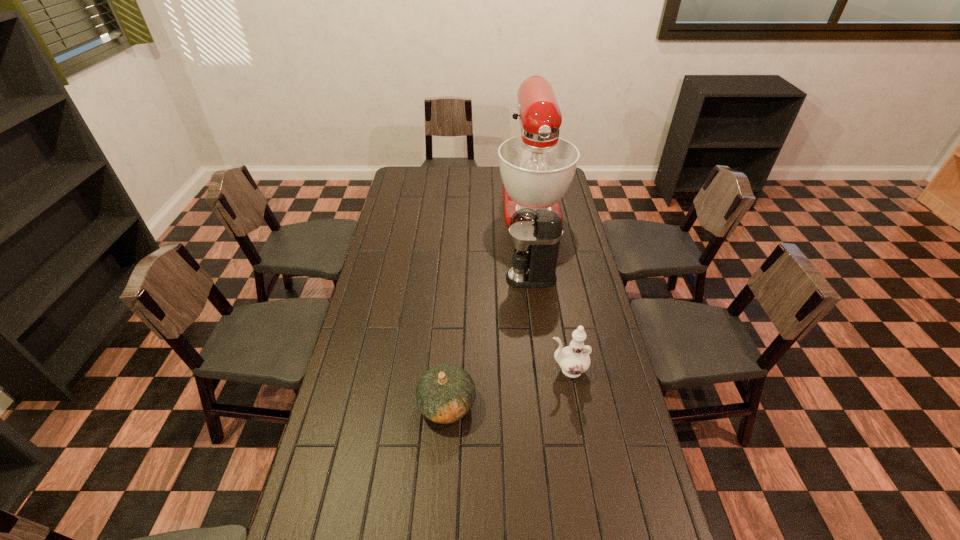
The height and width of the screenshot is (540, 960). In order to click on free spot located 0.090m place cup under the spout of the third shortest object in this screenshot , I will do `click(484, 278)`.

The image size is (960, 540). What are the coordinates of `free space located at the spout of the second shortest object` in the screenshot? It's located at (484, 369).

What are the coordinates of `free space located 0.380m at the spout of the second shortest object` in the screenshot? It's located at pyautogui.click(x=432, y=369).

Where is `vacant space located 0.100m at the spout of the second shortest object`? This screenshot has height=540, width=960. vacant space located 0.100m at the spout of the second shortest object is located at coordinates (517, 369).

Identify the location of blank area located on the back of the gourd. (449, 367).

Locate an element on the screen. The image size is (960, 540). object that is at the far edge is located at coordinates (537, 168).

Where is `mixer present at the right edge`? The width and height of the screenshot is (960, 540). mixer present at the right edge is located at coordinates (537, 168).

I want to click on coffee maker present at the right edge, so click(x=535, y=234).

This screenshot has width=960, height=540. Identify the location of chinaware positioned at the right edge. (574, 360).

Locate an element on the screen. The width and height of the screenshot is (960, 540). object that is at the far right corner is located at coordinates (537, 168).